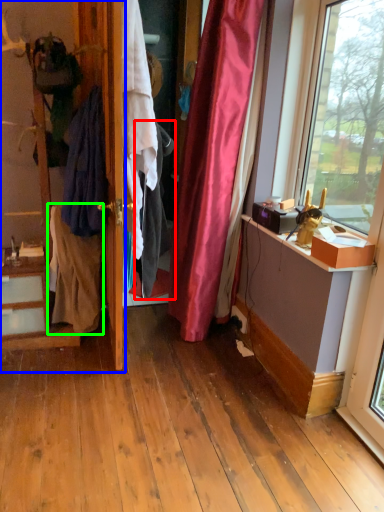
Question: Which object is positioned closest to clothing (highlighted by a red box)? Select from dresser (highlighted by a blue box) and clothing (highlighted by a green box).

Choices:
 (A) dresser
 (B) clothing

Answer: (B)